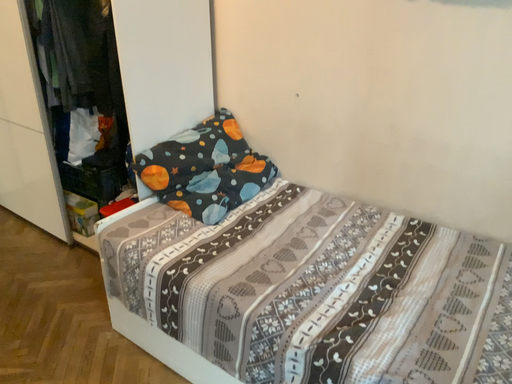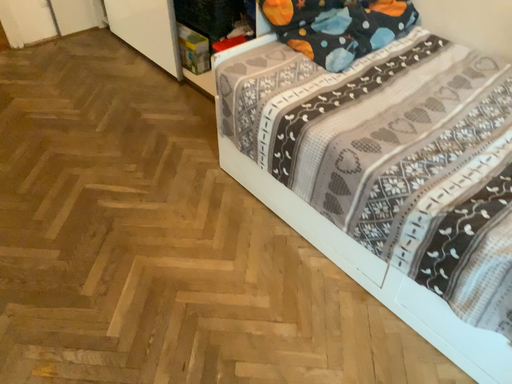
Question: Which way did the camera rotate in the video?

Choices:
 (A) rotated upward
 (B) rotated downward

Answer: (B)